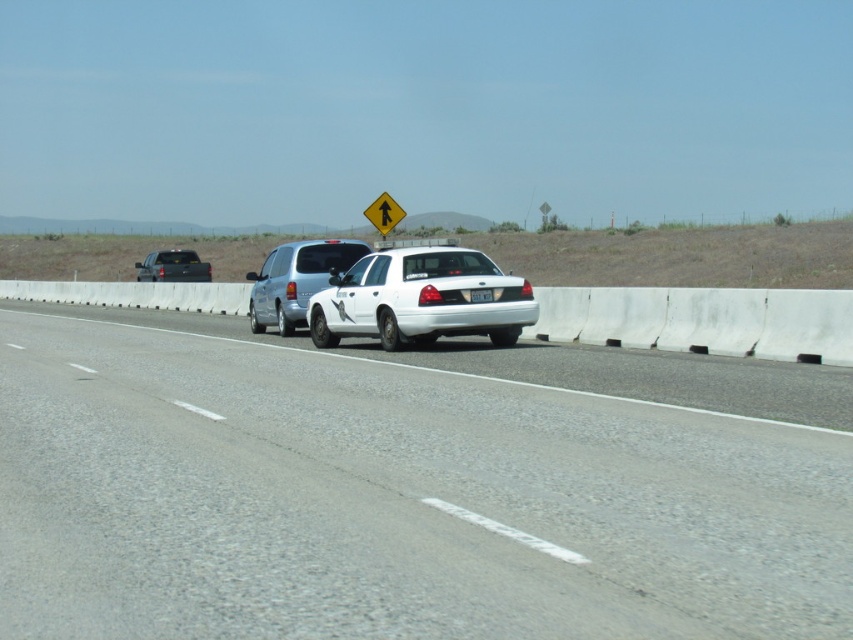
You are a drone operator trying to capture aerial footage of the highway scene. You have two points marked on your screen, point A at coordinates point (x=457, y=252) and point B at coordinates point (x=167, y=250). Which point should you focus on first if you want to capture the closest part of the scene to the camera?

Point A at coordinates point (x=457, y=252) is closer to the camera than point B at coordinates point (x=167, y=250), so you should focus on point A first.

You are a driver approaching the highway and see the white glossy car at center and the silver metallic minivan at center. Which vehicle should you expect to see first as you drive forward?

You will see the white glossy car at center first because it is closer to you than the silver metallic minivan at center.

You are a driver approaching the highway scene. You notice two points marked on the road ahead. The first point is at coordinates point (646, 636) and the second is at point (383, 212). Which point is closer to your current position?

Point (646, 636) is closer to the viewer than point (383, 212), so the first point is closer to your current position.